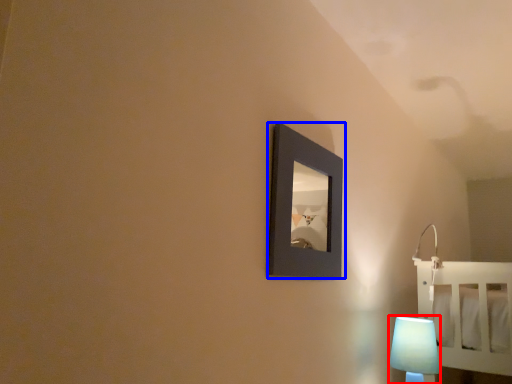
Question: Which point is closer to the camera, lamp (highlighted by a red box) or picture frame (highlighted by a blue box)?

Choices:
 (A) lamp
 (B) picture frame

Answer: (B)